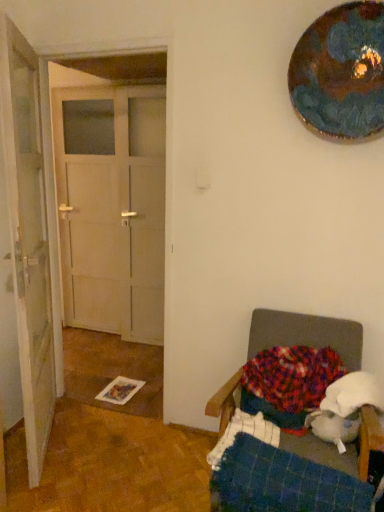
Question: Should I look upward or downward to see metallic reflective plate at upper right?

Choices:
 (A) up
 (B) down

Answer: (A)

Question: Is blue plaid blanket at lower right shorter than plush fabric chair at lower right?

Choices:
 (A) no
 (B) yes

Answer: (B)

Question: From the image's perspective, is blue plaid blanket at lower right beneath plush fabric chair at lower right?

Choices:
 (A) yes
 (B) no

Answer: (A)

Question: Does blue plaid blanket at lower right come in front of plush fabric chair at lower right?

Choices:
 (A) no
 (B) yes

Answer: (B)

Question: Does blue plaid blanket at lower right have a lesser width compared to plush fabric chair at lower right?

Choices:
 (A) no
 (B) yes

Answer: (B)

Question: Is blue plaid blanket at lower right positioned far away from plush fabric chair at lower right?

Choices:
 (A) no
 (B) yes

Answer: (A)

Question: Considering the relative sizes of blue plaid blanket at lower right and plush fabric chair at lower right in the image provided, is blue plaid blanket at lower right taller than plush fabric chair at lower right?

Choices:
 (A) no
 (B) yes

Answer: (A)

Question: Can you confirm if multicolored knitted blanket at lower right is positioned to the left of white wooden door at left, the second door in the right-to-left sequence?

Choices:
 (A) yes
 (B) no

Answer: (B)

Question: From a real-world perspective, does multicolored knitted blanket at lower right stand above white wooden door at left, the second door in the right-to-left sequence?

Choices:
 (A) yes
 (B) no

Answer: (B)

Question: Are multicolored knitted blanket at lower right and white wooden door at left, acting as the 1th door starting from the left, making contact?

Choices:
 (A) no
 (B) yes

Answer: (A)

Question: Is multicolored knitted blanket at lower right facing towards white wooden door at left, the second door in the right-to-left sequence?

Choices:
 (A) no
 (B) yes

Answer: (A)

Question: Is multicolored knitted blanket at lower right wider than white wooden door at left, the second door in the right-to-left sequence?

Choices:
 (A) yes
 (B) no

Answer: (A)

Question: Does multicolored knitted blanket at lower right have a lesser height compared to white wooden door at left, acting as the 1th door starting from the left?

Choices:
 (A) no
 (B) yes

Answer: (B)

Question: Does white wooden door at left, acting as the 1th door starting from the left, have a lesser width compared to metallic reflective plate at upper right?

Choices:
 (A) no
 (B) yes

Answer: (A)